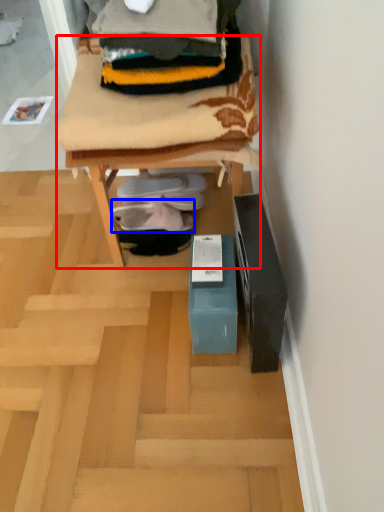
Question: Which of the following is the closest to the observer, furniture (highlighted by a red box) or footwear (highlighted by a blue box)?

Choices:
 (A) furniture
 (B) footwear

Answer: (A)